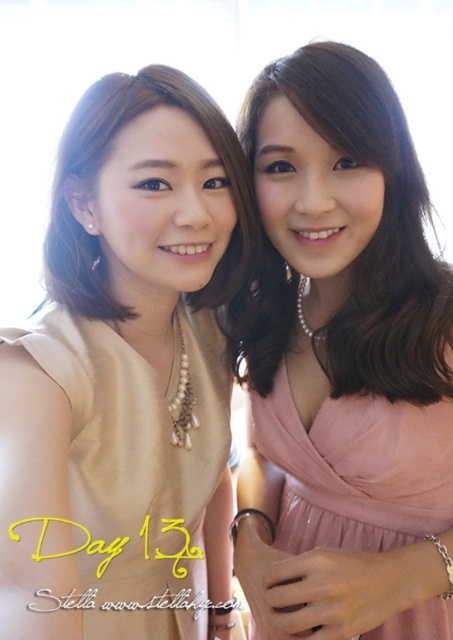
Can you confirm if pink satin dress at right is taller than matte gold necklace at upper left?

Indeed, pink satin dress at right has a greater height compared to matte gold necklace at upper left.

Is point (324, 467) less distant than point (106, 104)?

No, (324, 467) is behind (106, 104).

Locate an element on the screen. The width and height of the screenshot is (453, 640). pink satin dress at right is located at coordinates (356, 468).

Is pink satin dress at center positioned behind pink satin dress at right?

No, it is not.

Between pink satin dress at center and pink satin dress at right, which one is positioned higher?

pink satin dress at center is higher up.

Locate an element on the screen. Image resolution: width=453 pixels, height=640 pixels. pink satin dress at center is located at coordinates (343, 364).

This screenshot has width=453, height=640. What do you see at coordinates (125, 371) in the screenshot?
I see `matte beige dress at center` at bounding box center [125, 371].

Is point (168, 472) positioned before point (448, 512)?

Yes.

Image resolution: width=453 pixels, height=640 pixels. Find the location of `matte beige dress at center`. matte beige dress at center is located at coordinates 125,371.